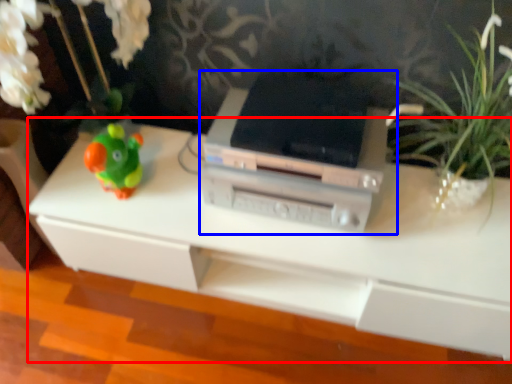
Question: Which point is further to the camera, table (highlighted by a red box) or printer (highlighted by a blue box)?

Choices:
 (A) table
 (B) printer

Answer: (B)